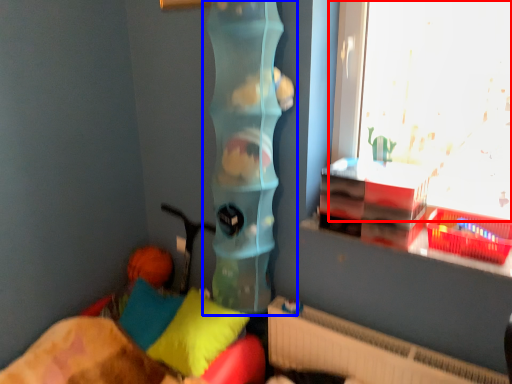
Question: Which object appears farthest to the camera in this image, window (highlighted by a red box) or toy (highlighted by a blue box)?

Choices:
 (A) window
 (B) toy

Answer: (B)